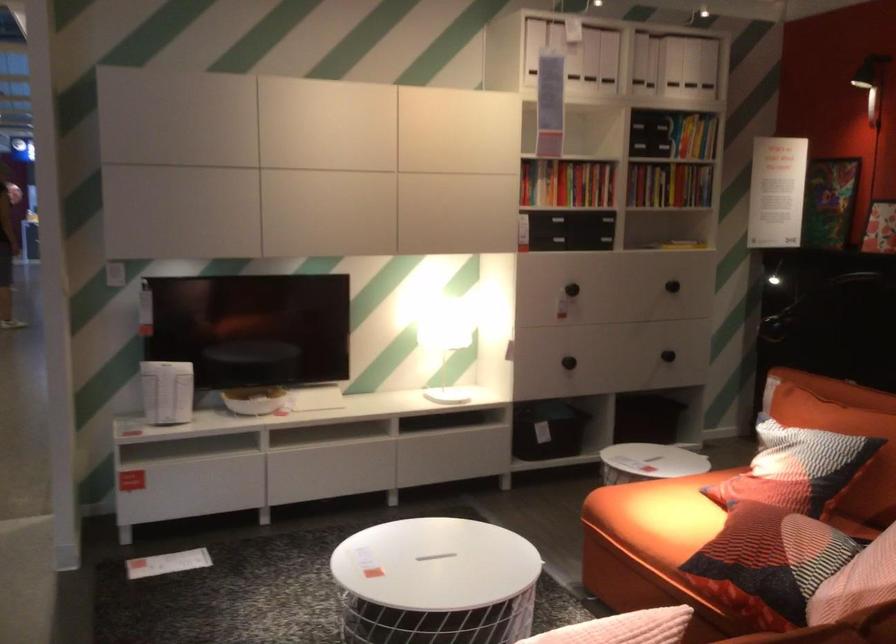
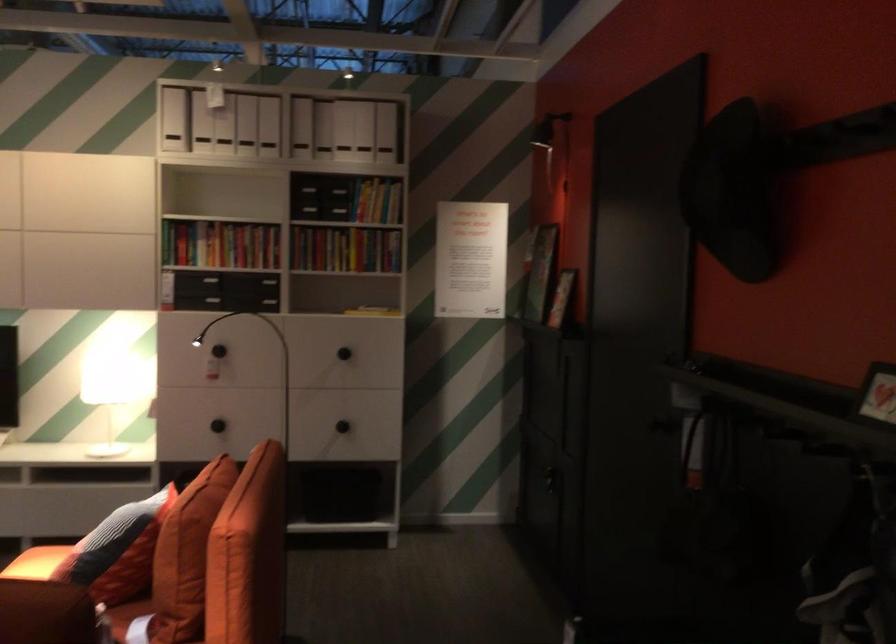
Find the pixel in the second image that matches (504,327) in the first image.

(108, 391)